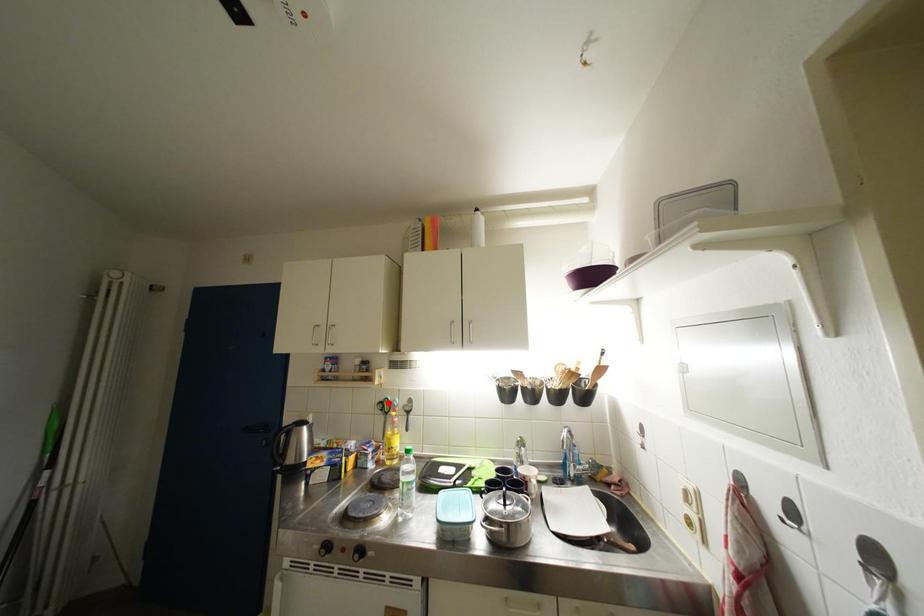
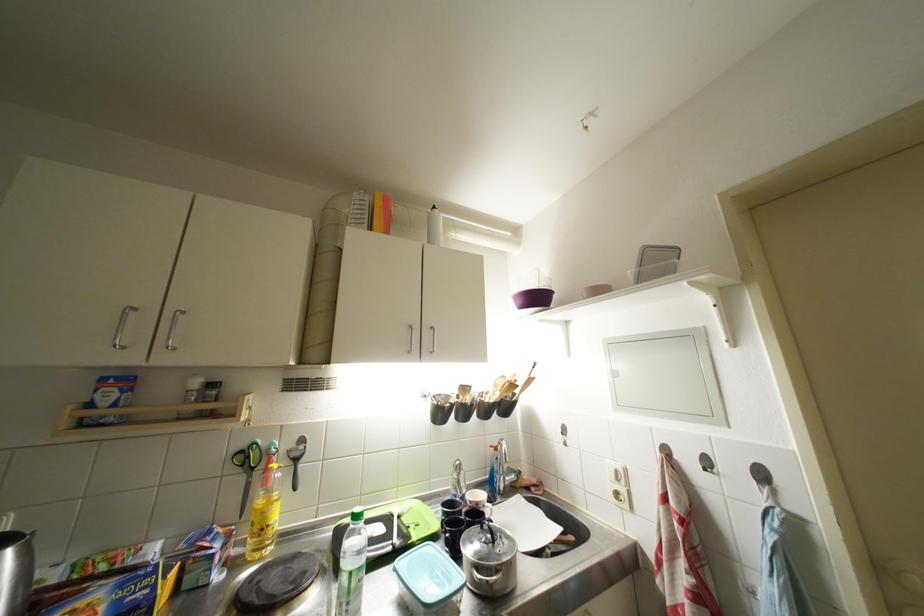
Find the pixel in the second image that matches the highlighted location in the first image.

(249, 450)